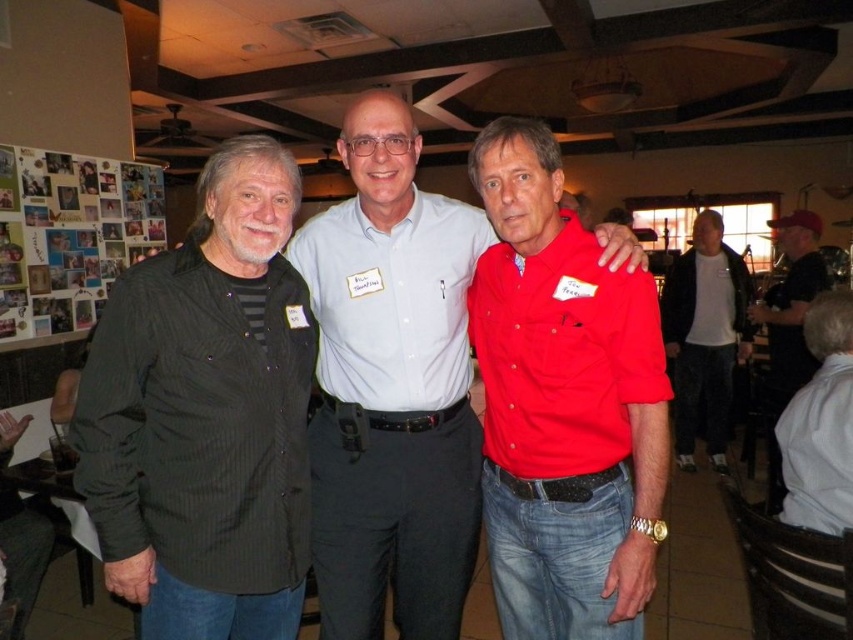
Based on the photo, between black textured shirt at left and white matte t-shirt at center-right, which one is positioned higher?

white matte t-shirt at center-right is higher up.

Which of these two, black textured shirt at left or white matte t-shirt at center-right, stands taller?

With more height is black textured shirt at left.

Does point (297, 179) come farther from viewer compared to point (720, 308)?

That is False.

The image size is (853, 640). In order to click on black textured shirt at left in this screenshot , I will do `click(206, 413)`.

Does black textured shirt at left appear on the left side of light blue button-down shirt at center?

Yes, black textured shirt at left is to the left of light blue button-down shirt at center.

Is black textured shirt at left taller than light blue button-down shirt at center?

Yes.

Does point (206, 161) come farther from viewer compared to point (428, 340)?

Yes, it is.

Identify the location of black textured shirt at left. (206, 413).

Does point (181, 627) come behind point (749, 346)?

No, it is in front of (749, 346).

Can you confirm if black textured shirt at left is positioned above white matte shirt at center?

No.

Measure the distance between black textured shirt at left and camera.

The distance of black textured shirt at left from camera is 4.53 feet.

In order to click on black textured shirt at left in this screenshot , I will do `click(206, 413)`.